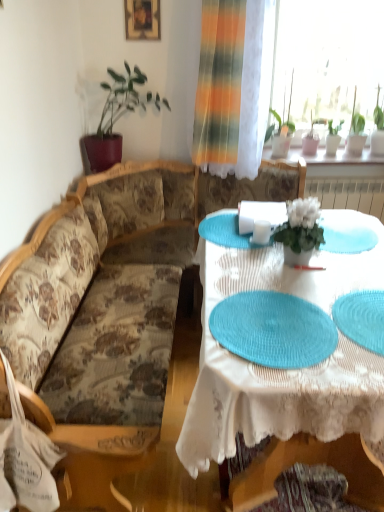
Identify the location of free space to the left of white matte flower pot at center, placed as the first houseplant when sorted from front to back. Image resolution: width=384 pixels, height=512 pixels. (254, 257).